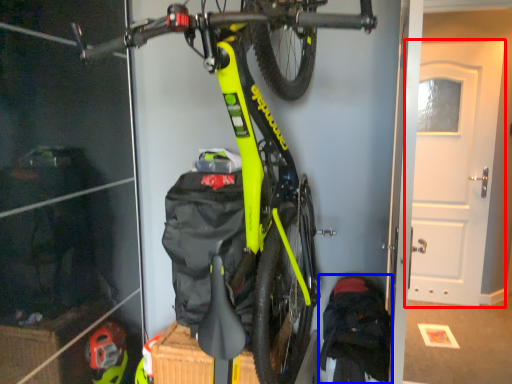
Question: Which point is further to the camera, door (highlighted by a red box) or backpack (highlighted by a blue box)?

Choices:
 (A) door
 (B) backpack

Answer: (A)